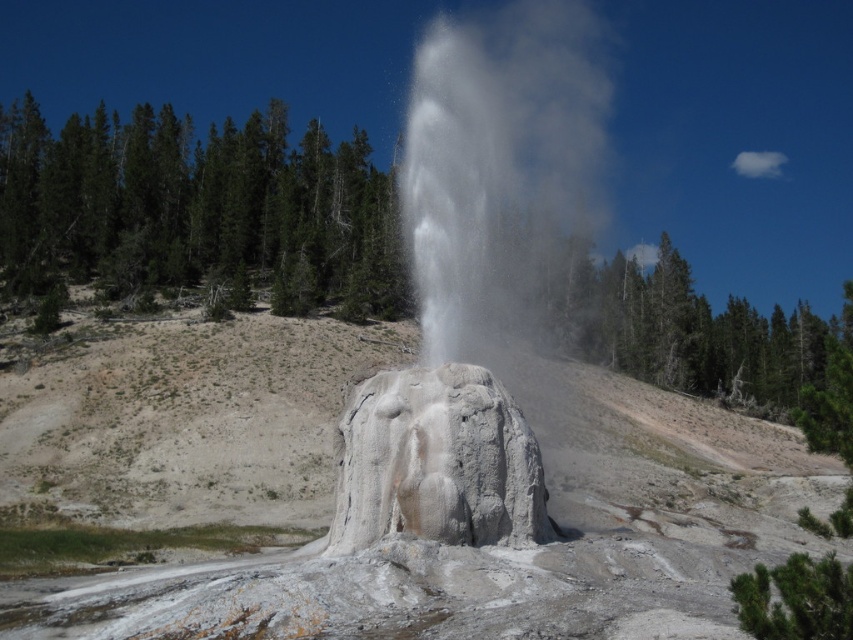
Question: Is the position of white stone geyser at center more distant than that of white textured rock at center?

Choices:
 (A) no
 (B) yes

Answer: (B)

Question: Observing the image, what is the correct spatial positioning of white stone geyser at center in reference to white textured rock at center?

Choices:
 (A) left
 (B) right

Answer: (B)

Question: Is white stone geyser at center thinner than white textured rock at center?

Choices:
 (A) no
 (B) yes

Answer: (A)